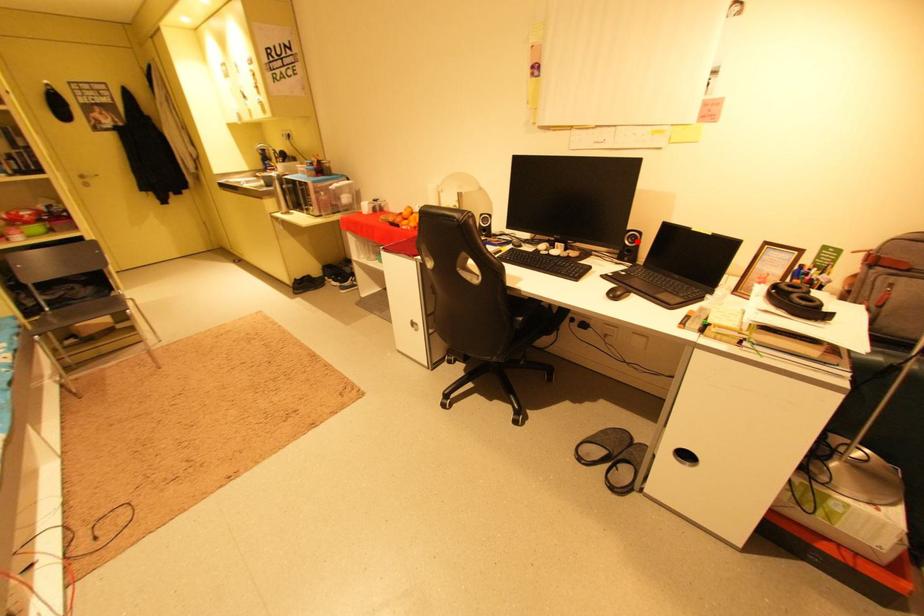
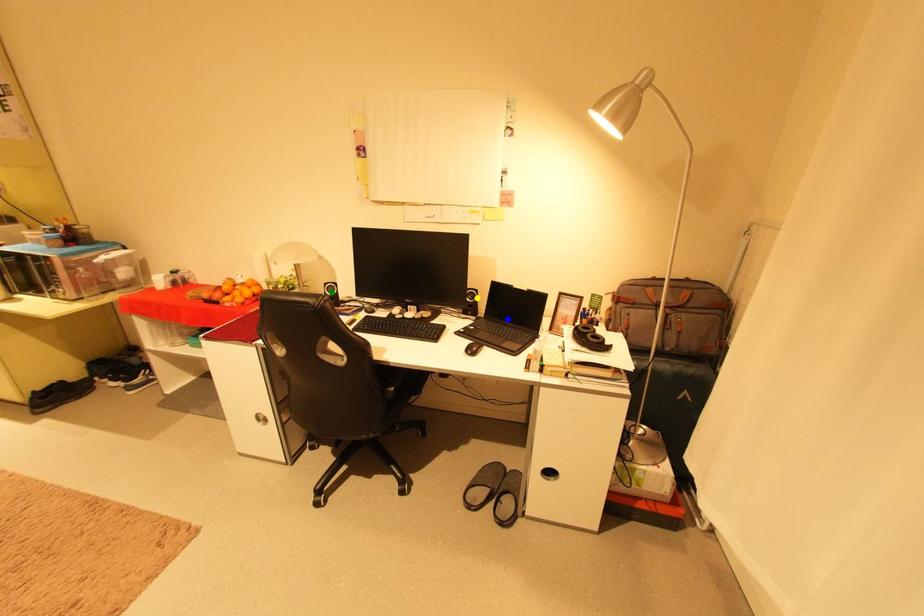
Question: I am providing you with two images of the same scene from different viewpoints. A red point is marked on the first image. You are given multiple points on the second image. Which point in image 2 represents the same 3d spot as the red point in image 1?

Choices:
 (A) green point
 (B) blue point
 (C) yellow point

Answer: (C)